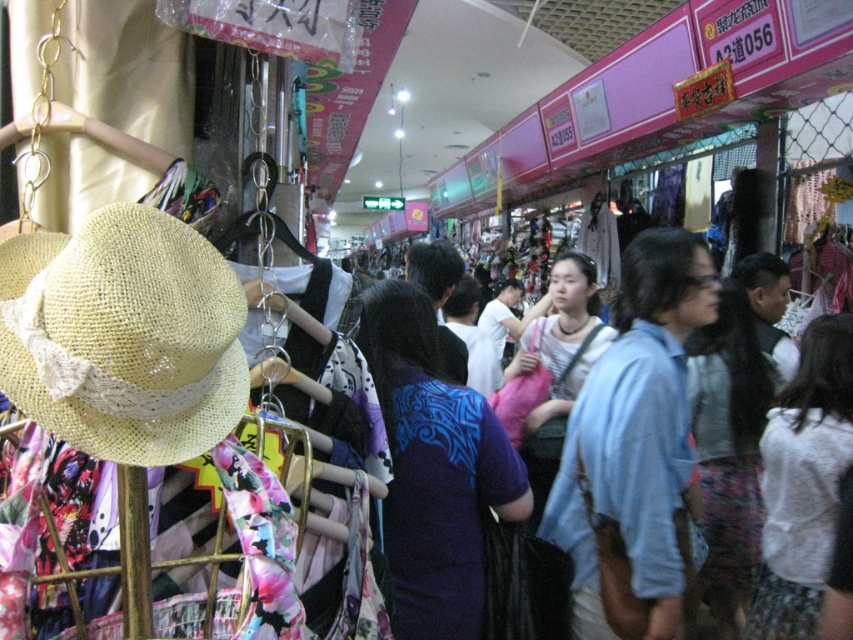
Who is positioned more to the right, straw hat at left or matte blue dress at center?

matte blue dress at center

Does straw hat at left appear over matte blue dress at center?

Yes, straw hat at left is above matte blue dress at center.

Does point (219, 317) lie behind point (700, 486)?

No, it is in front of (700, 486).

You are a GUI agent. You are given a task and a screenshot of the screen. Output one action in this format:
    pyautogui.click(x=<x>, y=<y>)
    Task: Click on the straw hat at left
    
    Given the screenshot: What is the action you would take?
    pyautogui.click(x=123, y=337)

Is point (474, 620) in front of point (728, 552)?

Yes, point (474, 620) is closer to viewer.

Is blue printed dress at center closer to the viewer compared to matte blue dress at center?

Yes, blue printed dress at center is in front of matte blue dress at center.

This screenshot has height=640, width=853. Identify the location of blue printed dress at center. (434, 468).

The image size is (853, 640). Identify the location of white cotton sweater at center. (804, 481).

Can you confirm if white cotton sweater at center is positioned to the left of matte blue dress at center?

Yes, white cotton sweater at center is to the left of matte blue dress at center.

Between point (782, 621) and point (708, 568), which one is positioned in front?

Point (782, 621) is more forward.

This screenshot has width=853, height=640. In order to click on white cotton sweater at center in this screenshot , I will do `click(804, 481)`.